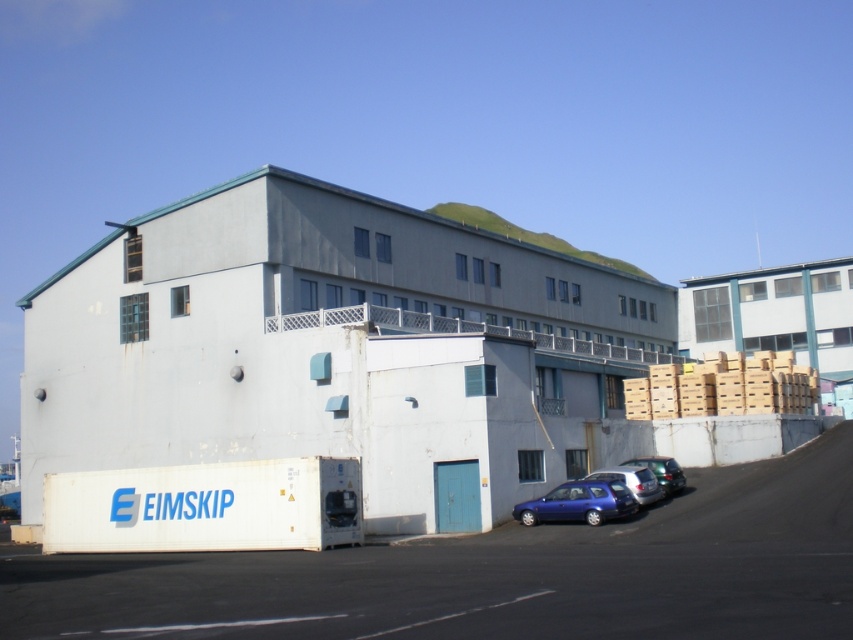
You are a delivery person needing to park your vehicle near the entrance of the building. You see the metallic blue hatchback at lower center and the metallic silver car at lower right. Which vehicle is parked closer to the entrance?

The metallic blue hatchback at lower center is closer to the entrance because it is closer to the viewer than the metallic silver car at lower right.

You are a delivery driver who needs to park your car in the area shown in the image. You have a blue metallic car at center and a metallic silver car at lower right. Which car is parked higher up relative to the other?

The blue metallic car at center is located above the metallic silver car at lower right, so it is parked higher up.

You are a delivery driver who needs to park your 2.5 meter wide truck between the metallic blue hatchback at lower center and the metallic silver car at lower right. Can you fit your truck in the space between them?

The distance between the metallic blue hatchback at lower center and the metallic silver car at lower right is 6.89 meters. Since your truck is 2.5 meters wide, there is enough space to park between them as 6.89 meters is greater than 2.5 meters.